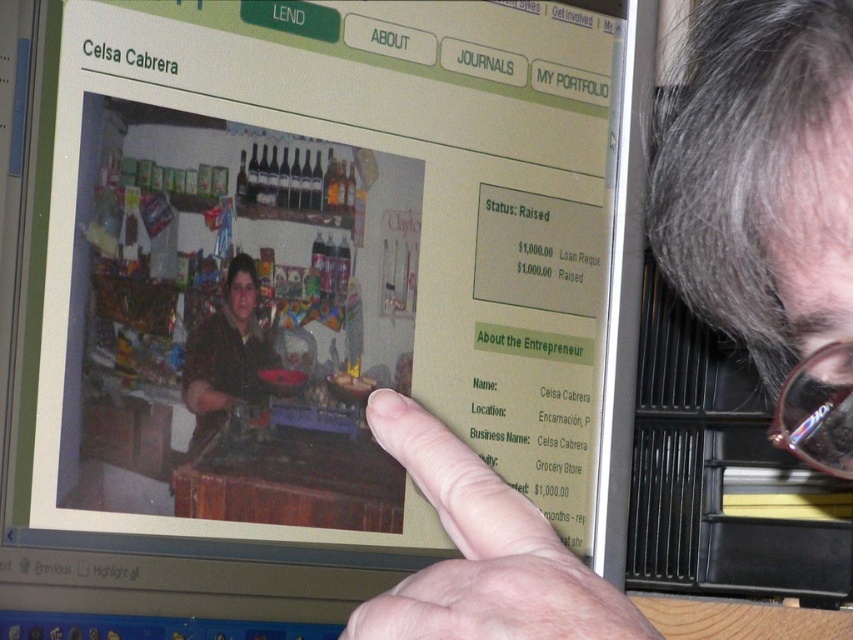
You are a user trying to click on the clear plastic glasses at upper right on the webpage. There is a skinny finger at upper right in the way. Can you click on the glasses without moving the finger?

The skinny finger at upper right is closer to the viewer than the clear plastic glasses at upper right, so the finger is blocking the glasses. You cannot click on the clear plastic glasses at upper right without moving the finger.

You are a user browsing the webpage and see the skinny finger at upper right and the clear plastic glasses at upper right. Which object is bigger in size?

The skinny finger at upper right has a larger size compared to the clear plastic glasses at upper right, so the skinny finger at upper right is bigger.

You are a graphic designer working on this webpage. You need to place a small icon that is 0.5 cm wide between the skinny finger at upper right and the clear plastic glasses at upper right. Can you fit it there without overlapping either object?

The skinny finger at upper right might be wider than clear plastic glasses at upper right, so there may not be enough space to fit a 0.5 cm wide icon between them without overlapping. You should check the exact dimensions of both objects to ensure proper placement.